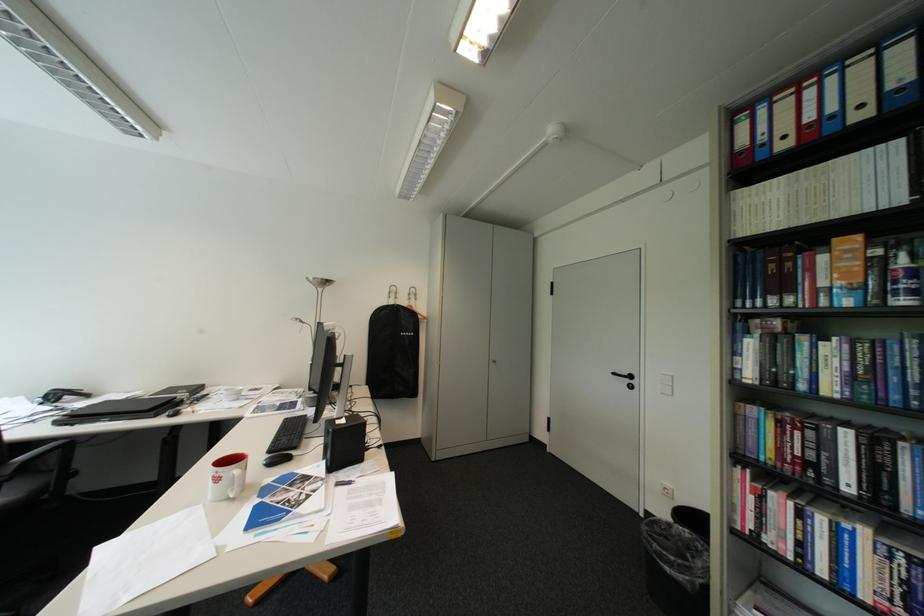
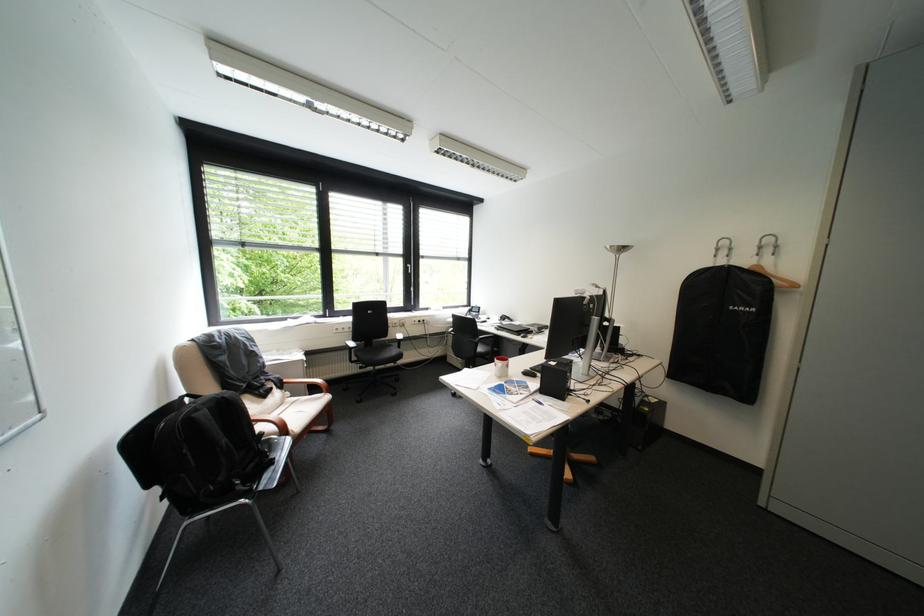
Find the pixel in the second image that matches [400,291] in the first image.

(727, 246)